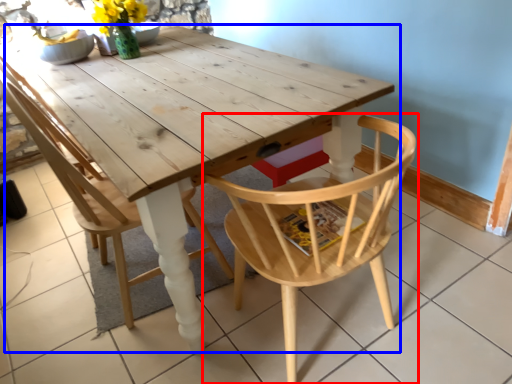
Question: Among these objects, which one is farthest to the camera, chair (highlighted by a red box) or table (highlighted by a blue box)?

Choices:
 (A) chair
 (B) table

Answer: (A)